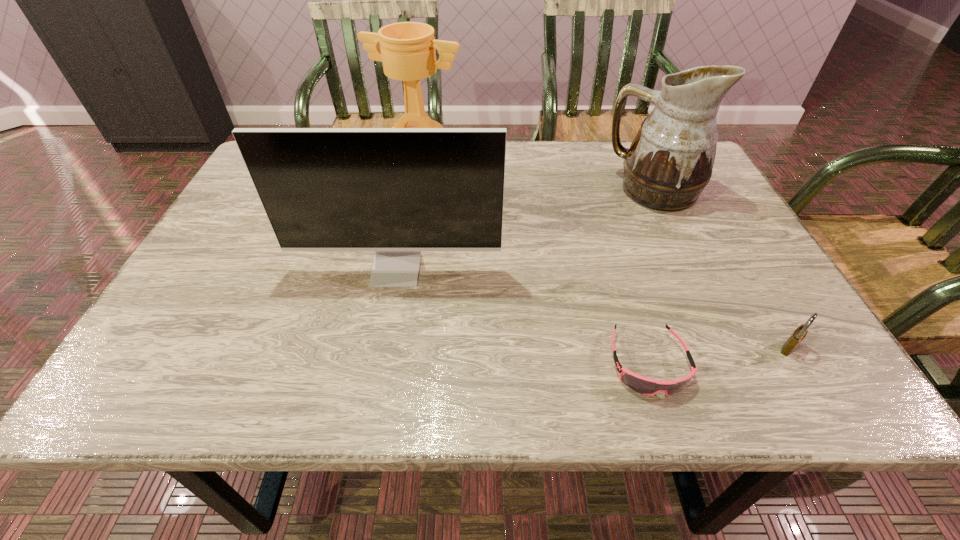
The width and height of the screenshot is (960, 540). Find the location of `vacant area that lies between the padlock and the third farthest object`. vacant area that lies between the padlock and the third farthest object is located at coordinates (592, 309).

Choose which object is the third nearest neighbor to the padlock. Please provide its 2D coordinates. Your answer should be formatted as a tuple, i.e. [(x, y)], where the tuple contains the x and y coordinates of a point satisfying the conditions above.

[(397, 191)]

Find the location of a particular element. The width and height of the screenshot is (960, 540). object that stands as the closest to the award is located at coordinates (397, 191).

Identify the location of free space that satisfies the following two spatial constraints: 1. from the spout of the pitcher; 2. on the front-facing side of the goggles. The height and width of the screenshot is (540, 960). (733, 363).

You are a GUI agent. You are given a task and a screenshot of the screen. Output one action in this format:
    pyautogui.click(x=<x>, y=<y>)
    Task: Click on the vacant space that satisfies the following two spatial constraints: 1. from the spout of the pitcher; 2. on the left side of the second shortest object
    Image resolution: width=960 pixels, height=540 pixels.
    Given the screenshot: What is the action you would take?
    pyautogui.click(x=727, y=348)

The width and height of the screenshot is (960, 540). In order to click on blank area in the image that satisfies the following two spatial constraints: 1. on the front-facing side of the monitor; 2. on the left side of the second shortest object in this screenshot , I will do `click(381, 348)`.

I want to click on free point that satisfies the following two spatial constraints: 1. on the front side of the second shortest object; 2. on the left side of the award, so click(389, 348).